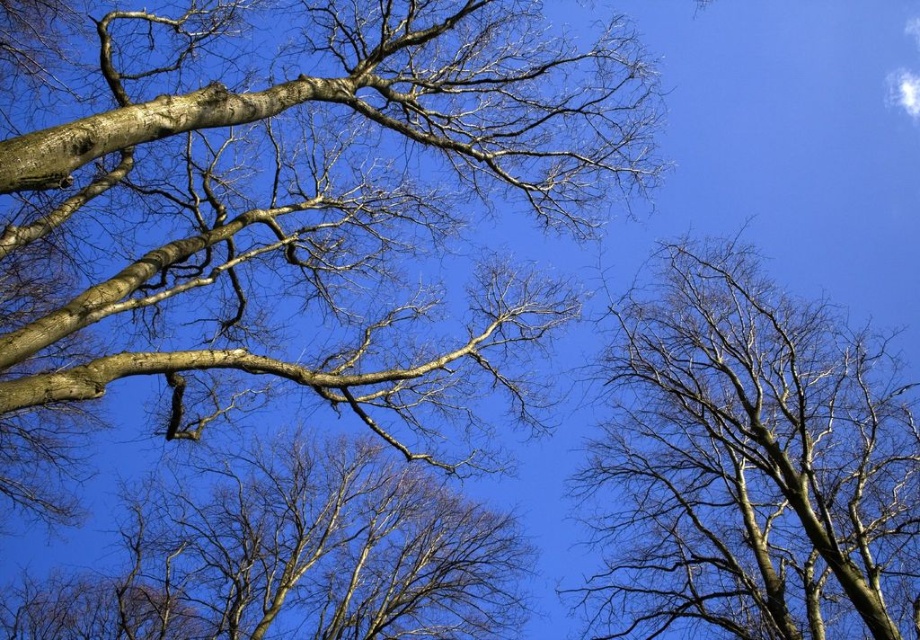
Question: Which of these objects is positioned closest to the bare branches at center?

Choices:
 (A) smooth bark tree at upper left
 (B) brown rough bark branch at upper left
 (C) smooth bark tree at upper right

Answer: (A)

Question: Which of the following is the closest to the observer?

Choices:
 (A) smooth bark tree at upper right
 (B) brown rough bark branch at upper left
 (C) bare branches at center
 (D) smooth bark tree at upper left

Answer: (B)

Question: Among these points, which one is farthest from the camera?

Choices:
 (A) (811, 509)
 (B) (497, 116)
 (C) (605, 33)
 (D) (466, 499)

Answer: (D)

Question: Observing the image, what is the correct spatial positioning of smooth bark tree at upper right in reference to brown rough bark branch at upper left?

Choices:
 (A) below
 (B) above

Answer: (A)

Question: Considering the relative positions of smooth bark tree at upper left and bare branches at center in the image provided, where is smooth bark tree at upper left located with respect to bare branches at center?

Choices:
 (A) above
 (B) below

Answer: (A)

Question: Does smooth bark tree at upper right have a lesser width compared to brown rough bark branch at upper left?

Choices:
 (A) yes
 (B) no

Answer: (A)